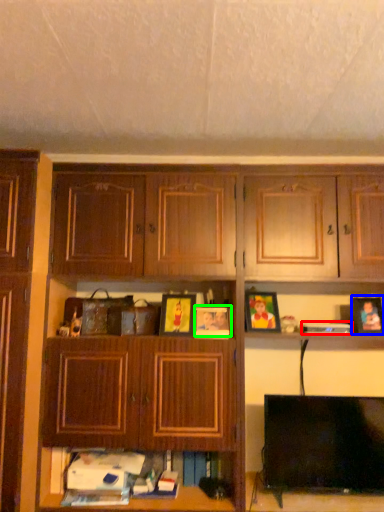
Question: Which object is the farthest from book (highlighted by a red box)? Choose among these: picture frame (highlighted by a blue box) or picture frame (highlighted by a green box).

Choices:
 (A) picture frame
 (B) picture frame

Answer: (B)